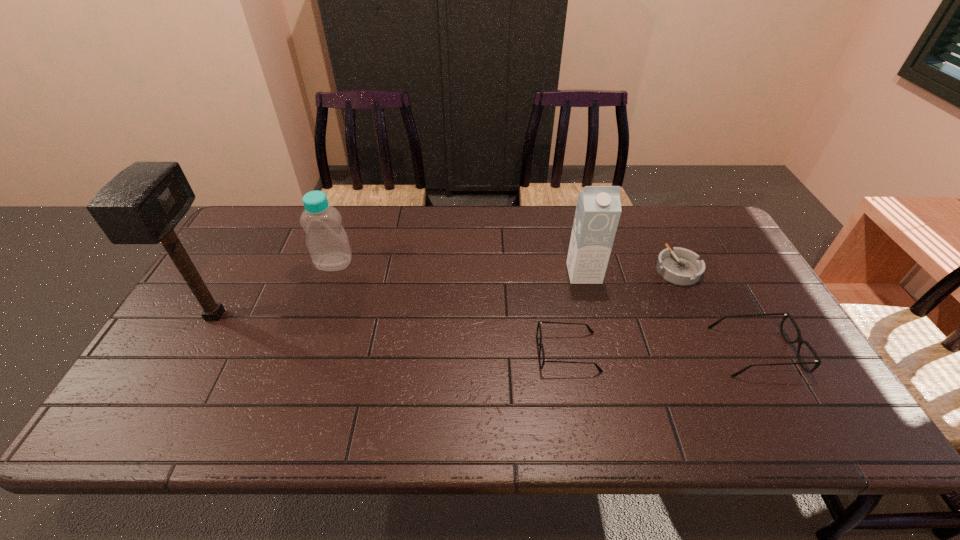
Image resolution: width=960 pixels, height=540 pixels. In order to click on the shorter spectacles in this screenshot , I will do `click(591, 331)`.

In order to click on the third shortest object in this screenshot , I will do `click(799, 339)`.

You are a GUI agent. You are given a task and a screenshot of the screen. Output one action in this format:
    pyautogui.click(x=<x>, y=<y>)
    Task: Click on the taller spectacles
    
    Given the screenshot: What is the action you would take?
    pyautogui.click(x=799, y=339)

Locate an element on the screen. mallet is located at coordinates tap(142, 204).

You are a GUI agent. You are given a task and a screenshot of the screen. Output one action in this format:
    pyautogui.click(x=<x>, y=<y>)
    Task: Click on the leftmost object
    Image resolution: width=960 pixels, height=540 pixels.
    Given the screenshot: What is the action you would take?
    pyautogui.click(x=142, y=204)

Locate an element on the screen. the fifth object from right to left is located at coordinates [327, 242].

Where is `bottle`? The image size is (960, 540). bottle is located at coordinates (327, 242).

Find the location of a particular element. the fifth shortest object is located at coordinates (598, 209).

The image size is (960, 540). Find the location of `ashtray`. ashtray is located at coordinates (680, 266).

Where is `vacant space situated with the lenses facing outward on the left spectacles`? This screenshot has height=540, width=960. vacant space situated with the lenses facing outward on the left spectacles is located at coordinates (679, 353).